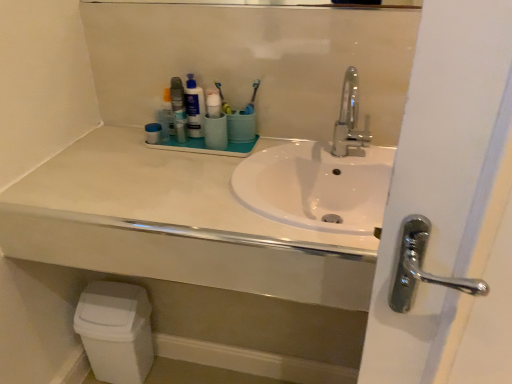
Question: Does polished chrome faucet at center have a greater width compared to matte plastic mouthwash at center?

Choices:
 (A) yes
 (B) no

Answer: (A)

Question: Is polished chrome faucet at center shorter than matte plastic mouthwash at center?

Choices:
 (A) no
 (B) yes

Answer: (A)

Question: From a real-world perspective, is polished chrome faucet at center under matte plastic mouthwash at center?

Choices:
 (A) no
 (B) yes

Answer: (A)

Question: Is polished chrome faucet at center far from matte plastic mouthwash at center?

Choices:
 (A) no
 (B) yes

Answer: (A)

Question: Is polished chrome faucet at center next to matte plastic mouthwash at center?

Choices:
 (A) yes
 (B) no

Answer: (B)

Question: Is polished chrome faucet at center to the right of matte plastic mouthwash at center from the viewer's perspective?

Choices:
 (A) yes
 (B) no

Answer: (A)

Question: Is white matte countertop at center directly adjacent to matte plastic container at upper center, which is the 1th toiletry in left-to-right order?

Choices:
 (A) no
 (B) yes

Answer: (A)

Question: Does white matte countertop at center have a larger size compared to matte plastic container at upper center, which is the 1th toiletry in left-to-right order?

Choices:
 (A) yes
 (B) no

Answer: (A)

Question: Considering the relative positions of white matte countertop at center and matte plastic container at upper center, which is counted as the 3th toiletry, starting from the right, in the image provided, is white matte countertop at center to the left of matte plastic container at upper center, which is counted as the 3th toiletry, starting from the right, from the viewer's perspective?

Choices:
 (A) yes
 (B) no

Answer: (B)

Question: Does white matte countertop at center have a lesser width compared to matte plastic container at upper center, which is the 1th toiletry in left-to-right order?

Choices:
 (A) yes
 (B) no

Answer: (B)

Question: Is white matte countertop at center aimed at matte plastic container at upper center, which is the 1th toiletry in left-to-right order?

Choices:
 (A) yes
 (B) no

Answer: (B)

Question: Is white matte countertop at center not inside matte plastic container at upper center, which is counted as the 3th toiletry, starting from the right?

Choices:
 (A) yes
 (B) no

Answer: (A)

Question: Are matte plastic mouthwash at center and polished chrome faucet at center located far from each other?

Choices:
 (A) yes
 (B) no

Answer: (B)